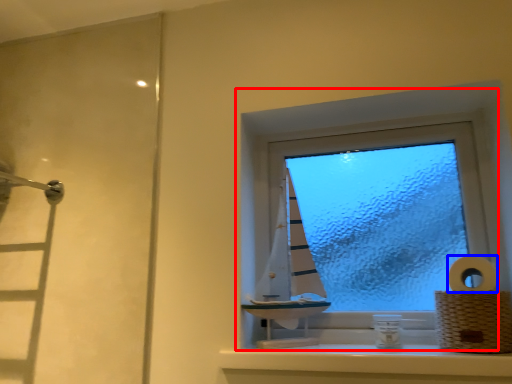
Question: Which of the following is the closest to the observer, window (highlighted by a red box) or toilet paper (highlighted by a blue box)?

Choices:
 (A) window
 (B) toilet paper

Answer: (B)